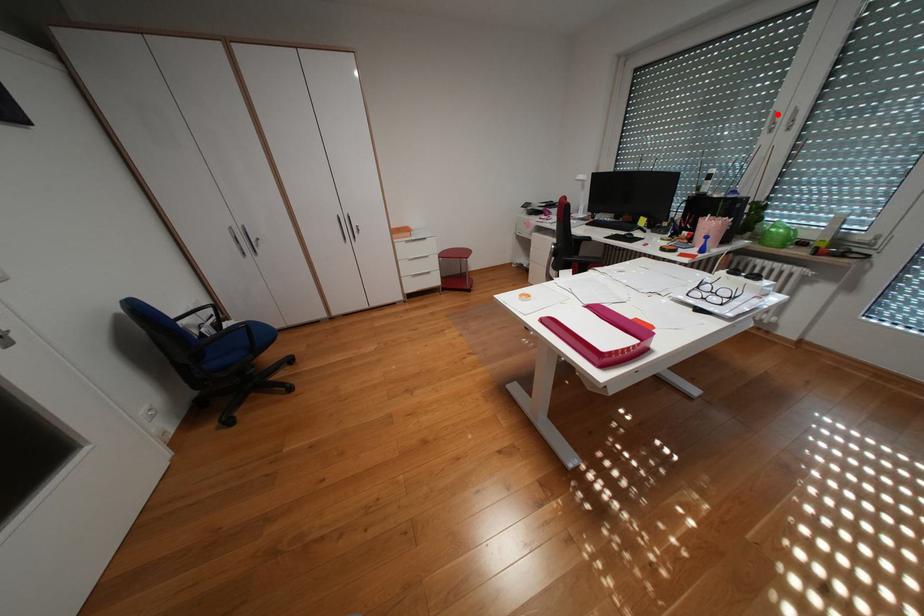
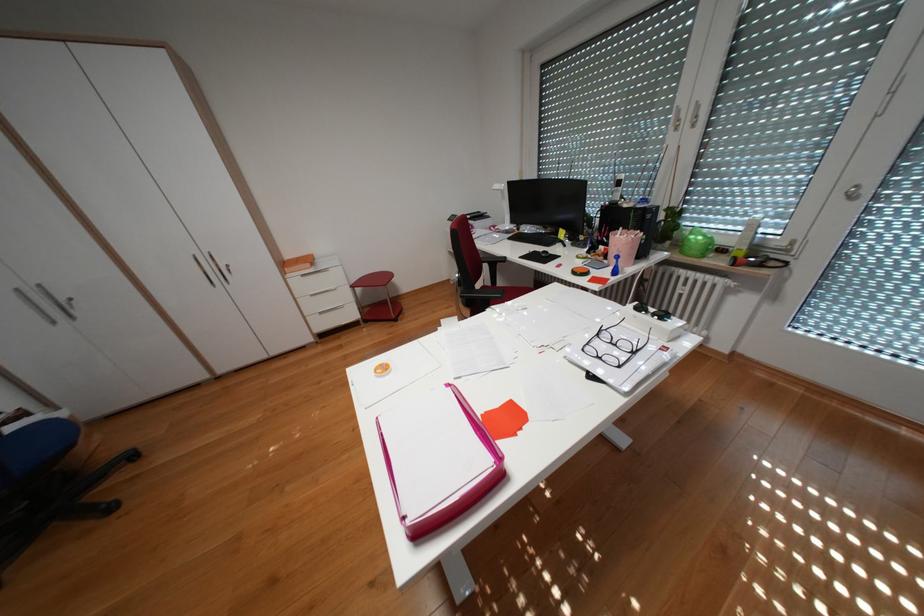
Question: I am providing you with two images of the same scene from different viewpoints. In image1, a red point is highlighted. Considering the same 3D point in image2, which of the following is correct?

Choices:
 (A) It is closer
 (B) It is farther

Answer: (A)